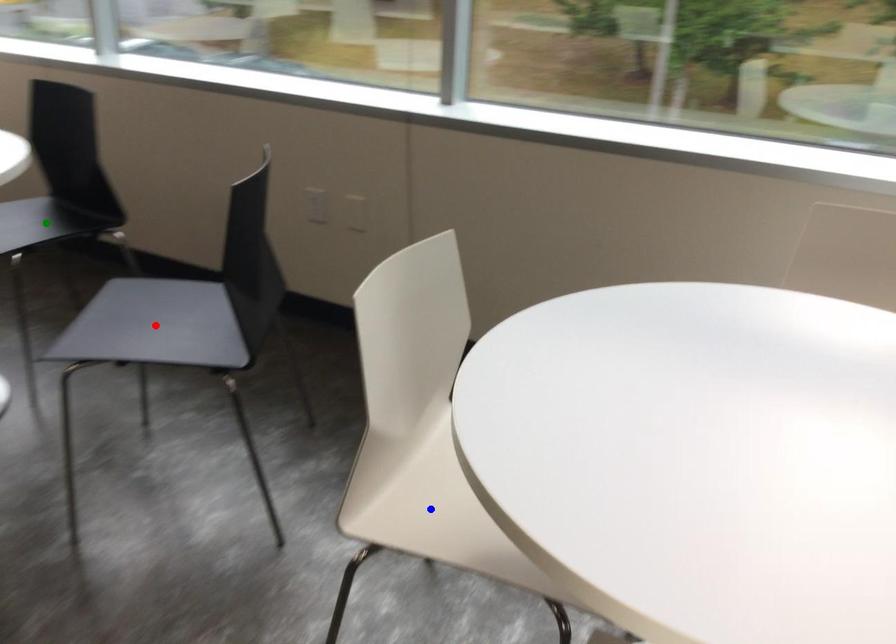
Order these from farthest to nearest:
green point | blue point | red point

Result: green point
red point
blue point